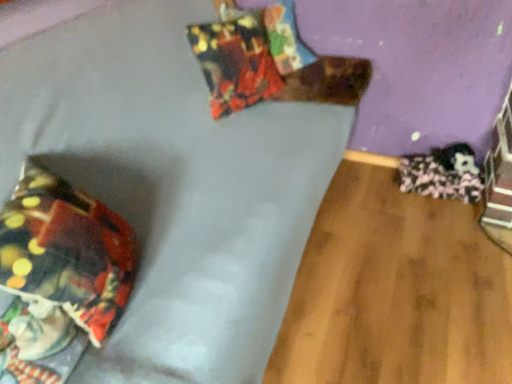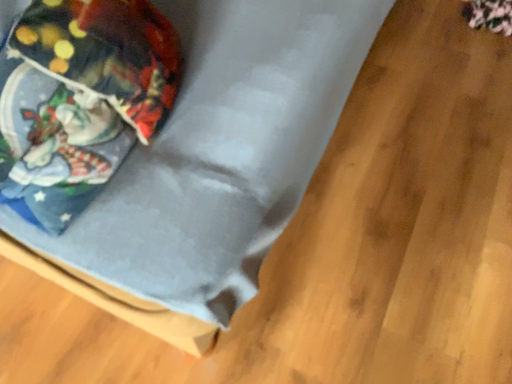
Question: How did the camera likely rotate when shooting the video?

Choices:
 (A) rotated downward
 (B) rotated upward

Answer: (A)